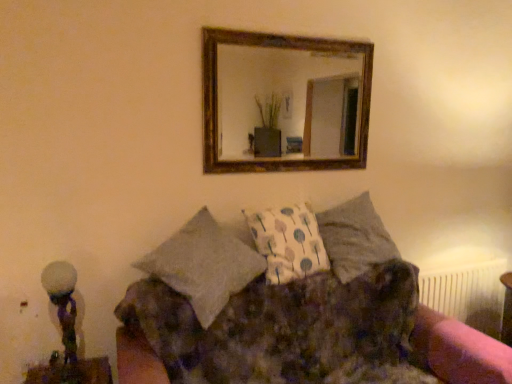
Question: Can you confirm if white frosted glass at left is positioned to the right of textured gray pillow at center?

Choices:
 (A) no
 (B) yes

Answer: (A)

Question: Is white frosted glass at left positioned with its back to textured gray pillow at center?

Choices:
 (A) yes
 (B) no

Answer: (B)

Question: Is white frosted glass at left not within textured gray pillow at center?

Choices:
 (A) no
 (B) yes

Answer: (B)

Question: Is white frosted glass at left aimed at textured gray pillow at center?

Choices:
 (A) no
 (B) yes

Answer: (A)

Question: From a real-world perspective, is white frosted glass at left located beneath textured gray pillow at center?

Choices:
 (A) yes
 (B) no

Answer: (A)

Question: In terms of size, does wooden-framed mirror at upper center appear bigger or smaller than textured gray pillow at center?

Choices:
 (A) small
 (B) big

Answer: (A)

Question: Would you say wooden-framed mirror at upper center is to the left or to the right of textured gray pillow at center in the picture?

Choices:
 (A) right
 (B) left

Answer: (B)

Question: Is point (306, 66) closer or farther from the camera than point (346, 281)?

Choices:
 (A) closer
 (B) farther

Answer: (B)

Question: In terms of height, does wooden-framed mirror at upper center look taller or shorter compared to textured gray pillow at center?

Choices:
 (A) tall
 (B) short

Answer: (A)

Question: From a real-world perspective, relative to fluffy fabric couch at center, is white plastic radiator at lower right vertically above or below?

Choices:
 (A) above
 (B) below

Answer: (A)

Question: From the image's perspective, is white plastic radiator at lower right above or below fluffy fabric couch at center?

Choices:
 (A) below
 (B) above

Answer: (B)

Question: Is white plastic radiator at lower right to the left or to the right of fluffy fabric couch at center in the image?

Choices:
 (A) right
 (B) left

Answer: (A)

Question: Is white plastic radiator at lower right taller or shorter than fluffy fabric couch at center?

Choices:
 (A) tall
 (B) short

Answer: (B)

Question: Relative to textured gray pillow at center, is white frosted glass at left in front or behind?

Choices:
 (A) front
 (B) behind

Answer: (A)

Question: Based on their positions, is white frosted glass at left located to the left or right of textured gray pillow at center?

Choices:
 (A) left
 (B) right

Answer: (A)